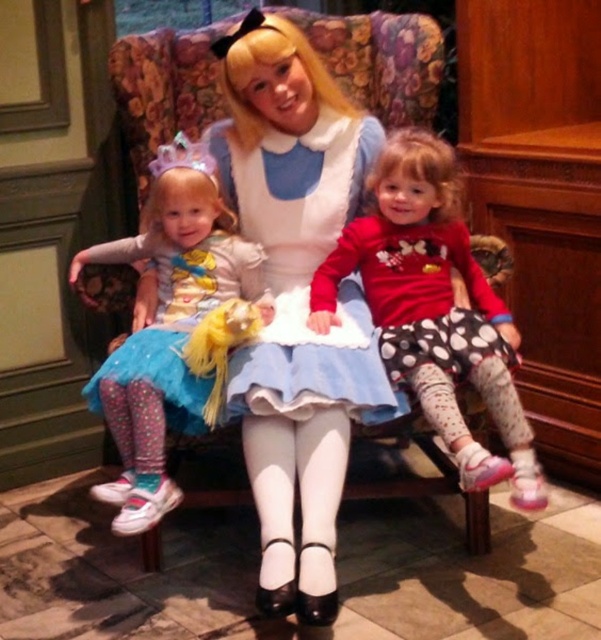
Question: Can you confirm if polka dot leggings at center is smaller than blue satin dress at center?

Choices:
 (A) no
 (B) yes

Answer: (A)

Question: Can you confirm if floral fabric armchair at center is bigger than pastel polka dot leggings at left?

Choices:
 (A) yes
 (B) no

Answer: (A)

Question: Can you confirm if pastel polka dot leggings at left is positioned to the right of blue tulle skirt at left?

Choices:
 (A) no
 (B) yes

Answer: (B)

Question: Which is farther from the blue tulle skirt at left?

Choices:
 (A) polka dot leggings at center
 (B) floral fabric armchair at center
 (C) pastel polka dot leggings at left

Answer: (A)

Question: Among these points, which one is farthest from the camera?

Choices:
 (A) (85, 385)
 (B) (419, 400)

Answer: (A)

Question: Considering the real-world distances, which object is farthest from the pastel polka dot leggings at left?

Choices:
 (A) polka dot leggings at center
 (B) blue tulle skirt at left
 (C) floral fabric armchair at center
 (D) blue satin dress at center

Answer: (A)